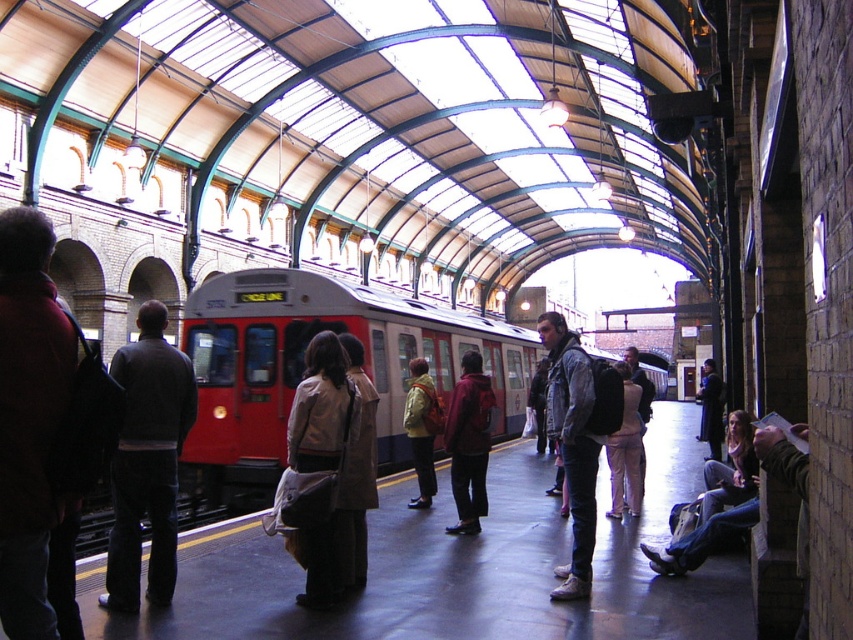
You are a passenger waiting for your train at the station. You see a dark gray sweater at left and a yellow fabric jacket at center. Which clothing item is narrower?

The dark gray sweater at left is narrower than the yellow fabric jacket at center.

Consider the image. You are a passenger waiting at the train station platform. You see the red matte train at center and the yellow fabric jacket at center. Which object is positioned higher from the ground?

The red matte train at center is above the yellow fabric jacket at center, so the red matte train at center is positioned higher from the ground.

You are standing on the train platform and want to board the red matte train at center. The safety line is 2 feet away from you. Is the train within the safe boarding distance?

The red matte train at center is 42.55 feet away from the viewer, which is much farther than the 2 feet safety line. Therefore, the train is not within the safe boarding distance and you should move closer to the safety line before boarding.